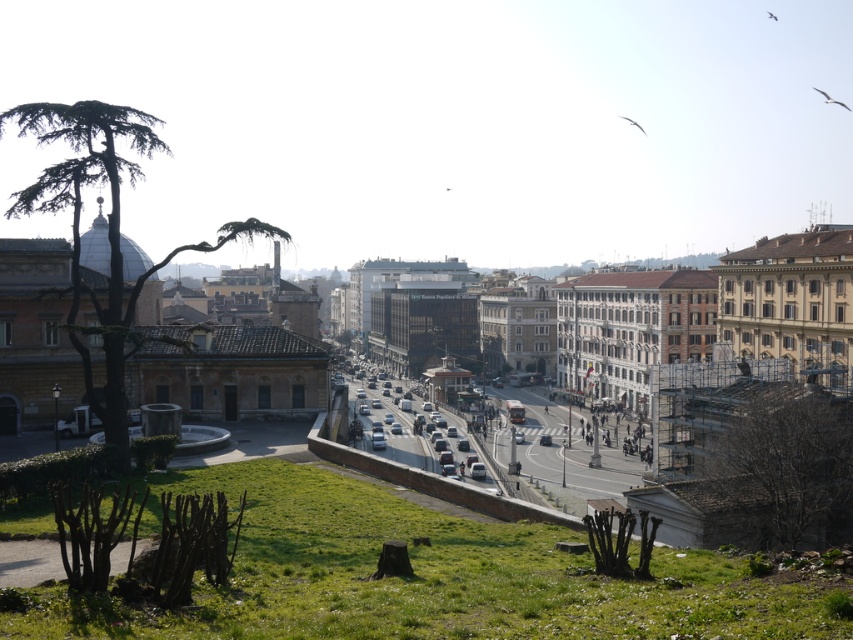
Question: Can you confirm if green leafy palm tree at left is smaller than silver metallic car at center?

Choices:
 (A) no
 (B) yes

Answer: (A)

Question: Which point is farther from the camera taking this photo?

Choices:
 (A) (123, 362)
 (B) (376, 429)

Answer: (B)

Question: Can you confirm if green leafy palm tree at left is positioned to the right of silver metallic car at center?

Choices:
 (A) no
 (B) yes

Answer: (A)

Question: Among these objects, which one is nearest to the camera?

Choices:
 (A) silver metallic car at center
 (B) green leafy palm tree at left

Answer: (B)

Question: Which point is farther to the camera?

Choices:
 (A) green leafy palm tree at left
 (B) silver metallic car at center

Answer: (B)

Question: Where is green leafy palm tree at left located in relation to silver metallic car at center in the image?

Choices:
 (A) left
 (B) right

Answer: (A)